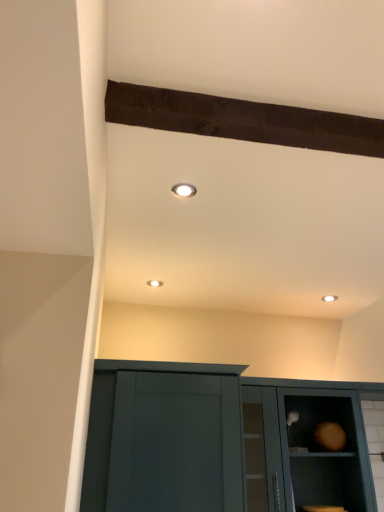
The width and height of the screenshot is (384, 512). Describe the element at coordinates (306, 445) in the screenshot. I see `matte teal cabinet at lower right` at that location.

You are a GUI agent. You are given a task and a screenshot of the screen. Output one action in this format:
    pyautogui.click(x=<x>, y=<y>)
    Task: Click on the matte white recessed light at upper center
    
    Given the screenshot: What is the action you would take?
    pyautogui.click(x=184, y=190)

Is matte teal cabinet at lower right not within matte dark green cabinet door at lower center?

Yes.

Is matte teal cabinet at lower right next to matte dark green cabinet door at lower center and touching it?

No, matte teal cabinet at lower right is not next to matte dark green cabinet door at lower center.

Considering the relative positions of matte teal cabinet at lower right and matte dark green cabinet door at lower center in the image provided, is matte teal cabinet at lower right to the left or to the right of matte dark green cabinet door at lower center?

matte teal cabinet at lower right is positioned on matte dark green cabinet door at lower center's right side.

Considering the points (189, 191) and (341, 480), which point is behind, point (189, 191) or point (341, 480)?

Positioned behind is point (341, 480).

Looking at this image, which object is thinner, matte white recessed light at upper center or matte teal cabinet at lower right?

matte white recessed light at upper center is thinner.

Is there a large distance between matte white recessed light at upper center and matte teal cabinet at lower right?

matte white recessed light at upper center is positioned a significant distance from matte teal cabinet at lower right.

Based on the photo, from a real-world perspective, relative to matte teal cabinet at lower right, is matte white recessed light at upper center vertically above or below?

matte white recessed light at upper center is situated higher than matte teal cabinet at lower right in the real world.

Locate an element on the screen. The image size is (384, 512). cabinetry below the matte white recessed light at upper center (from the image's perspective) is located at coordinates (306, 445).

Considering the relative sizes of matte teal cabinet at lower right and matte white recessed light at upper center in the image provided, is matte teal cabinet at lower right bigger than matte white recessed light at upper center?

Indeed, matte teal cabinet at lower right has a larger size compared to matte white recessed light at upper center.

From the image's perspective, between matte teal cabinet at lower right and matte white recessed light at upper center, who is located below?

matte teal cabinet at lower right is shown below in the image.

Based on the photo, how different are the orientations of matte teal cabinet at lower right and matte white recessed light at upper center in degrees?

The angular difference between matte teal cabinet at lower right and matte white recessed light at upper center is 88.9 degrees.

Based on their sizes in the image, would you say matte dark green cabinet door at lower center is bigger or smaller than matte white recessed light at upper center?

matte dark green cabinet door at lower center is bigger than matte white recessed light at upper center.

Find the location of a particular element. glass door below the matte white recessed light at upper center (from a real-world perspective) is located at coordinates (166, 443).

Which is more to the left, matte dark green cabinet door at lower center or matte white recessed light at upper center?

From the viewer's perspective, matte dark green cabinet door at lower center appears more on the left side.

Can you confirm if matte dark green cabinet door at lower center is shorter than matte white recessed light at upper center?

No.

Is matte white recessed light at upper center placed right next to matte dark green cabinet door at lower center?

matte white recessed light at upper center and matte dark green cabinet door at lower center are not in contact.

Based on the photo, could matte dark green cabinet door at lower center be considered to be inside matte white recessed light at upper center?

No, matte dark green cabinet door at lower center is not a part of matte white recessed light at upper center.

Considering the points (178, 194) and (155, 495), which point is behind, point (178, 194) or point (155, 495)?

The point (155, 495) is more distant.

Can you tell me how much matte dark green cabinet door at lower center and matte teal cabinet at lower right differ in facing direction?

0.000388 degrees separate the facing orientations of matte dark green cabinet door at lower center and matte teal cabinet at lower right.

Is matte dark green cabinet door at lower center outside of matte teal cabinet at lower right?

Absolutely, matte dark green cabinet door at lower center is external to matte teal cabinet at lower right.

Looking at this image, from a real-world perspective, is matte dark green cabinet door at lower center positioned over matte teal cabinet at lower right based on gravity?

Yes, from a real-world perspective, matte dark green cabinet door at lower center is over matte teal cabinet at lower right

Is matte dark green cabinet door at lower center at the left side of matte teal cabinet at lower right?

Indeed, matte dark green cabinet door at lower center is positioned on the left side of matte teal cabinet at lower right.

Where is `cabinetry that is under the matte dark green cabinet door at lower center (from a real-world perspective)`? cabinetry that is under the matte dark green cabinet door at lower center (from a real-world perspective) is located at coordinates (306, 445).

Find the location of a particular element. This screenshot has height=512, width=384. cabinetry on the right side of matte white recessed light at upper center is located at coordinates [306, 445].

Considering their positions, is matte white recessed light at upper center positioned further to matte dark green cabinet door at lower center than matte teal cabinet at lower right?

matte white recessed light at upper center is further to matte dark green cabinet door at lower center.

Based on their spatial positions, is matte teal cabinet at lower right or matte white recessed light at upper center closer to matte dark green cabinet door at lower center?

matte teal cabinet at lower right lies closer to matte dark green cabinet door at lower center than the other object.

Considering their positions, is matte white recessed light at upper center positioned further to matte teal cabinet at lower right than matte dark green cabinet door at lower center?

Among the two, matte white recessed light at upper center is located further to matte teal cabinet at lower right.

From the image, which object appears to be farther from matte teal cabinet at lower right, matte dark green cabinet door at lower center or matte white recessed light at upper center?

matte white recessed light at upper center is positioned further to the anchor matte teal cabinet at lower right.

Estimate the real-world distances between objects in this image. Which object is further from matte white recessed light at upper center, matte teal cabinet at lower right or matte dark green cabinet door at lower center?

Based on the image, matte teal cabinet at lower right appears to be further to matte white recessed light at upper center.

Estimate the real-world distances between objects in this image. Which object is closer to matte white recessed light at upper center, matte dark green cabinet door at lower center or matte teal cabinet at lower right?

Among the two, matte dark green cabinet door at lower center is located nearer to matte white recessed light at upper center.

Where is `glass door that lies between matte white recessed light at upper center and matte teal cabinet at lower right from top to bottom`? This screenshot has width=384, height=512. glass door that lies between matte white recessed light at upper center and matte teal cabinet at lower right from top to bottom is located at coordinates (166, 443).